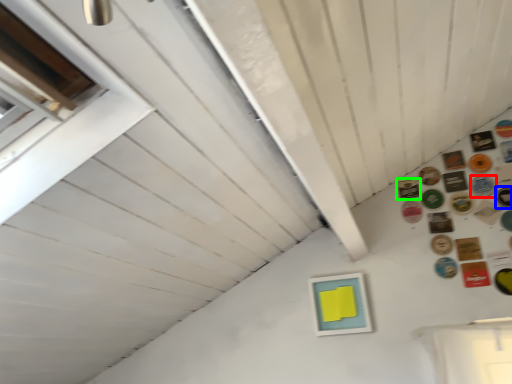
Question: Which is farther away from button (highlighted by a red box)? button (highlighted by a blue box) or button (highlighted by a green box)?

Choices:
 (A) button
 (B) button

Answer: (B)